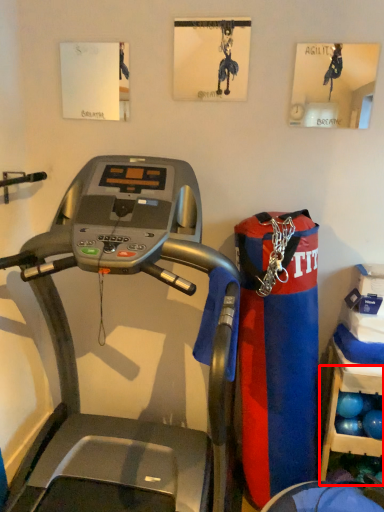
Question: From the image, what is the correct spatial relationship of shelf (annotated by the red box) in relation to treadmill?

Choices:
 (A) left
 (B) right

Answer: (B)